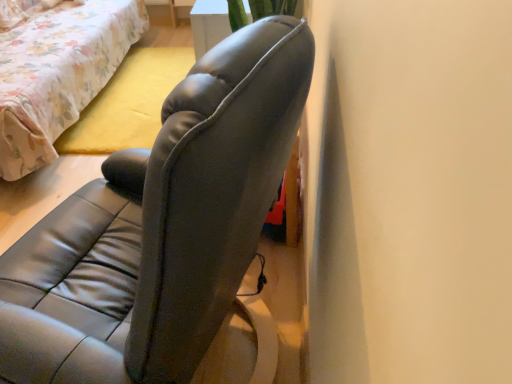
Question: Is floral fabric bed at upper left bigger than leather-like gray chair at center?

Choices:
 (A) yes
 (B) no

Answer: (A)

Question: From the image's perspective, would you say floral fabric bed at upper left is positioned over leather-like gray chair at center?

Choices:
 (A) no
 (B) yes

Answer: (B)

Question: From the image's perspective, is floral fabric bed at upper left beneath leather-like gray chair at center?

Choices:
 (A) yes
 (B) no

Answer: (B)

Question: Does floral fabric bed at upper left lie in front of leather-like gray chair at center?

Choices:
 (A) yes
 (B) no

Answer: (B)

Question: Is floral fabric bed at upper left not within leather-like gray chair at center?

Choices:
 (A) yes
 (B) no

Answer: (A)

Question: Does floral fabric bed at upper left have a smaller size compared to leather-like gray chair at center?

Choices:
 (A) no
 (B) yes

Answer: (A)

Question: From the image's perspective, is leather-like gray chair at center below floral fabric bed at upper left?

Choices:
 (A) yes
 (B) no

Answer: (A)

Question: Is floral fabric bed at upper left at the back of leather-like gray chair at center?

Choices:
 (A) no
 (B) yes

Answer: (A)

Question: Is leather-like gray chair at center next to floral fabric bed at upper left and touching it?

Choices:
 (A) yes
 (B) no

Answer: (B)

Question: Does leather-like gray chair at center have a greater height compared to floral fabric bed at upper left?

Choices:
 (A) yes
 (B) no

Answer: (A)

Question: Does leather-like gray chair at center have a greater width compared to floral fabric bed at upper left?

Choices:
 (A) yes
 (B) no

Answer: (B)

Question: From the image's perspective, would you say leather-like gray chair at center is positioned over floral fabric bed at upper left?

Choices:
 (A) yes
 (B) no

Answer: (B)

Question: Is floral fabric bed at upper left inside or outside of leather-like gray chair at center?

Choices:
 (A) outside
 (B) inside

Answer: (A)